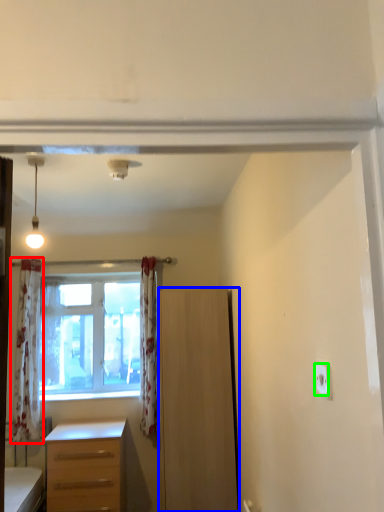
Question: Which is farther away from curtain (highlighted by a red box)? cabinetry (highlighted by a blue box) or electric outlet (highlighted by a green box)?

Choices:
 (A) cabinetry
 (B) electric outlet

Answer: (B)